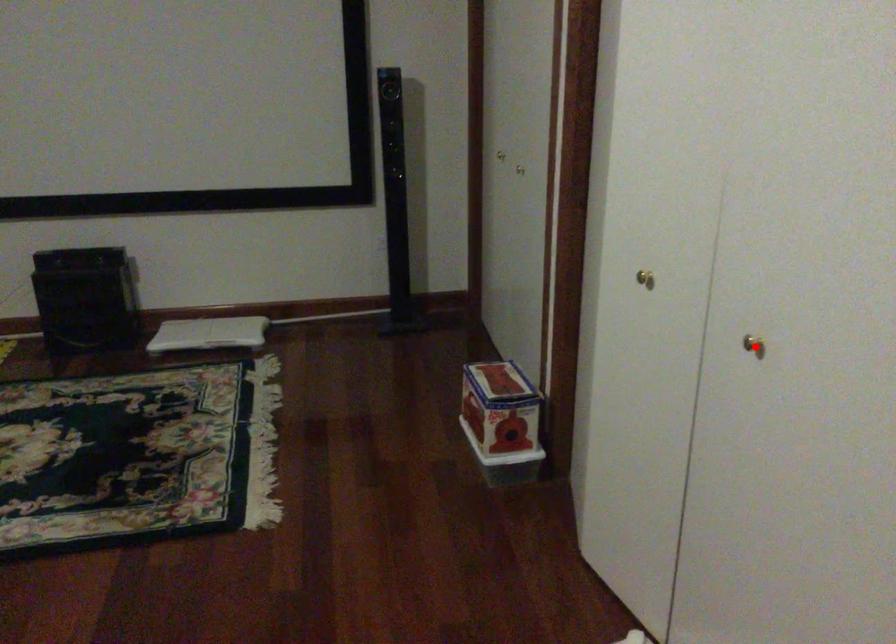
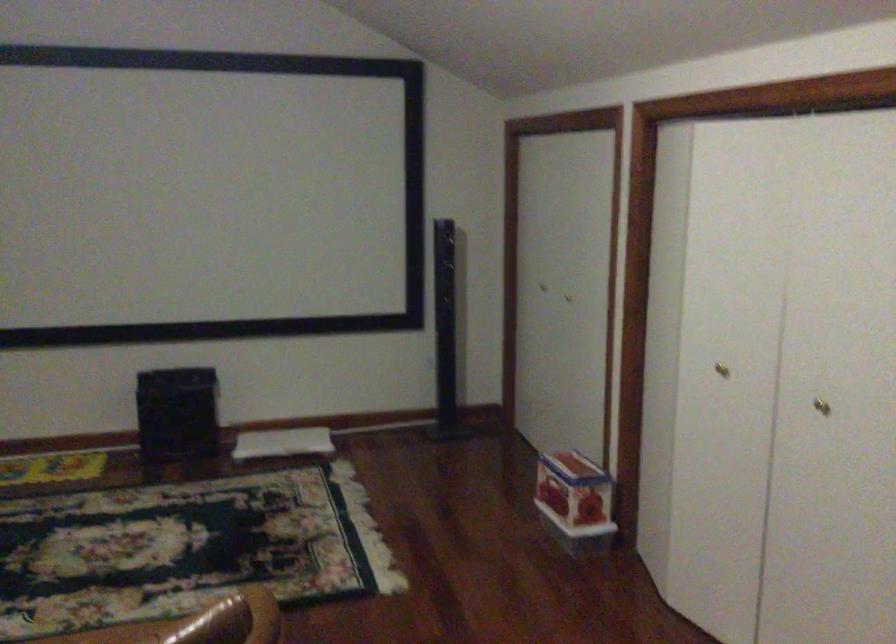
Question: I am providing you with two images of the same scene from different viewpoints. A red point is shown in image1. For the corresponding object point in image2, is it positioned nearer or farther from the camera?

Choices:
 (A) Nearer
 (B) Farther

Answer: (B)